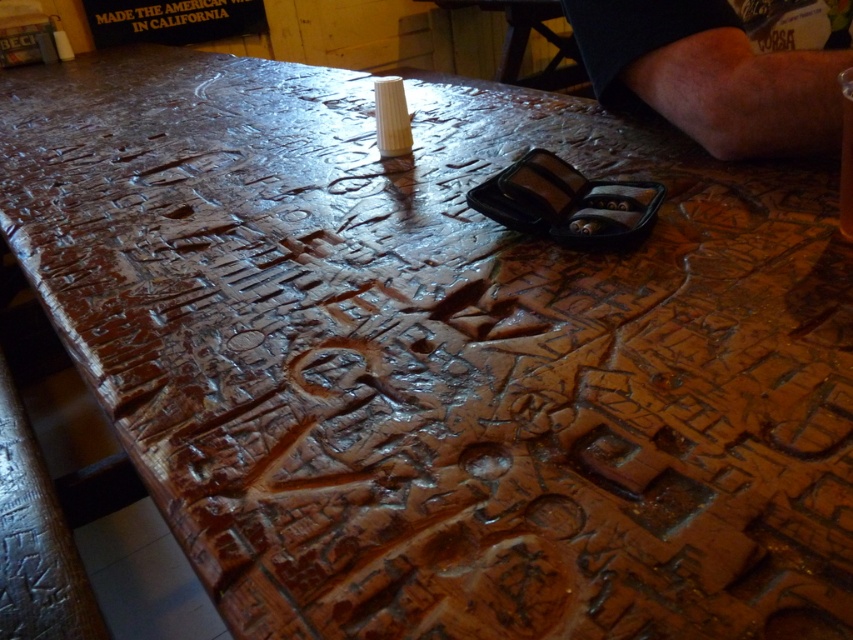
Question: Observing the image, what is the correct spatial positioning of black plastic text at upper center in reference to translucent glass beer at upper center?

Choices:
 (A) below
 (B) above

Answer: (B)

Question: Is dark skin at upper right smaller than translucent glass beer at upper center?

Choices:
 (A) no
 (B) yes

Answer: (A)

Question: Does black plastic text at upper center appear on the left side of translucent glass beer at upper center?

Choices:
 (A) no
 (B) yes

Answer: (B)

Question: Which object appears farthest from the camera in this image?

Choices:
 (A) dark skin at upper right
 (B) black plastic text at upper center

Answer: (B)

Question: Which of these objects is positioned farthest from the black plastic text at upper center?

Choices:
 (A) translucent glass beer at upper center
 (B) dark skin at upper right

Answer: (A)

Question: Which point is closer to the camera taking this photo?

Choices:
 (A) (808, 67)
 (B) (845, 106)
 (C) (160, 12)

Answer: (B)